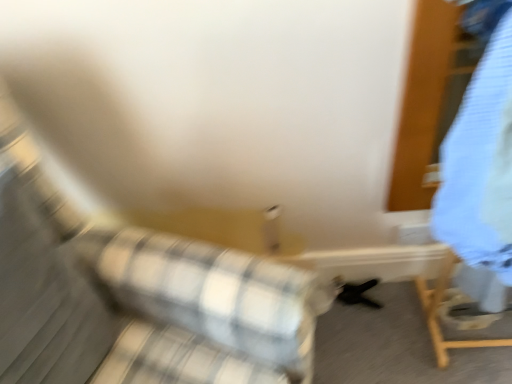
Question: Can we say light blue fabric at right lies outside plaid fabric couch at center?

Choices:
 (A) yes
 (B) no

Answer: (A)

Question: Does light blue fabric at right have a smaller size compared to plaid fabric couch at center?

Choices:
 (A) yes
 (B) no

Answer: (A)

Question: From the image's perspective, is light blue fabric at right located above plaid fabric couch at center?

Choices:
 (A) no
 (B) yes

Answer: (B)

Question: Can you confirm if light blue fabric at right is positioned to the left of plaid fabric couch at center?

Choices:
 (A) yes
 (B) no

Answer: (B)

Question: From a real-world perspective, is light blue fabric at right located beneath plaid fabric couch at center?

Choices:
 (A) yes
 (B) no

Answer: (B)

Question: From a real-world perspective, is light blue fabric at right on top of plaid fabric couch at center?

Choices:
 (A) yes
 (B) no

Answer: (A)

Question: Is light blue fabric at right completely or partially inside plaid fabric couch at center?

Choices:
 (A) no
 (B) yes

Answer: (A)

Question: Can you confirm if plaid fabric couch at center is shorter than light blue fabric at right?

Choices:
 (A) yes
 (B) no

Answer: (B)

Question: From a real-world perspective, is plaid fabric couch at center positioned under light blue fabric at right based on gravity?

Choices:
 (A) yes
 (B) no

Answer: (A)

Question: From the image's perspective, is plaid fabric couch at center located beneath light blue fabric at right?

Choices:
 (A) yes
 (B) no

Answer: (A)

Question: Is plaid fabric couch at center behind light blue fabric at right?

Choices:
 (A) no
 (B) yes

Answer: (A)

Question: Would you consider plaid fabric couch at center to be distant from light blue fabric at right?

Choices:
 (A) yes
 (B) no

Answer: (B)

Question: From the image's perspective, is plaid fabric couch at center positioned above or below light blue fabric at right?

Choices:
 (A) above
 (B) below

Answer: (B)